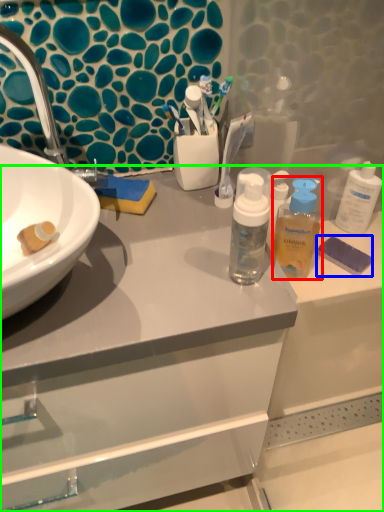
Question: Based on their relative distances, which object is farther from mouthwash (highlighted by a red box)? Choose from soap (highlighted by a blue box) and bathroom cabinet (highlighted by a green box).

Choices:
 (A) soap
 (B) bathroom cabinet

Answer: (B)